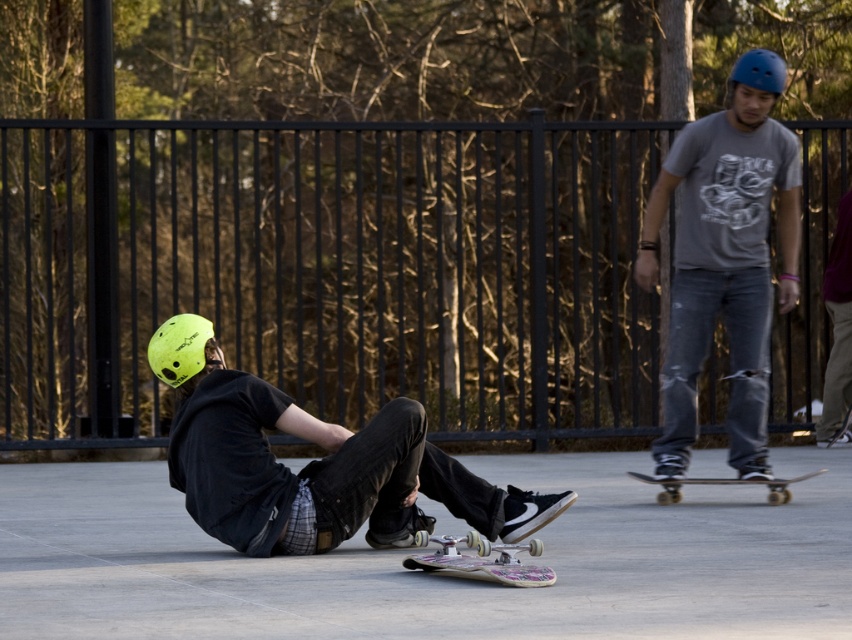
You are a photographer setting up a tripod to capture the skatepark scene. The neon yellow helmet at lower left and the wooden skateboard at center are both in your shot. Based on their sizes in the image, which object appears larger?

The neon yellow helmet at lower left appears larger because it is much taller than the wooden skateboard at center in the image.

You are a photographer trying to capture a photo of the wooden skateboard at center without including the neon yellow helmet at lower left in the frame. Based on their positions, is this possible?

The neon yellow helmet at lower left is above the wooden skateboard at center, so if you position your camera to focus on the skateboard at center and angle it slightly downward, you can avoid including the helmet in the shot.